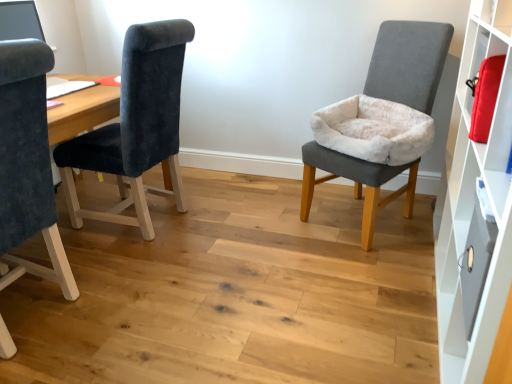
Question: Can you confirm if metallic gray drawer at right is bigger than velvet dark blue chair at left, positioned as the second chair in right-to-left order?

Choices:
 (A) no
 (B) yes

Answer: (A)

Question: From a real-world perspective, is metallic gray drawer at right on velvet dark blue chair at left, the second chair positioned from the left?

Choices:
 (A) no
 (B) yes

Answer: (A)

Question: Is the position of metallic gray drawer at right more distant than that of velvet dark blue chair at left, the second chair positioned from the left?

Choices:
 (A) yes
 (B) no

Answer: (B)

Question: Considering the relative sizes of metallic gray drawer at right and velvet dark blue chair at left, positioned as the second chair in right-to-left order, in the image provided, is metallic gray drawer at right taller than velvet dark blue chair at left, positioned as the second chair in right-to-left order,?

Choices:
 (A) no
 (B) yes

Answer: (A)

Question: Is metallic gray drawer at right positioned far away from velvet dark blue chair at left, positioned as the second chair in right-to-left order?

Choices:
 (A) yes
 (B) no

Answer: (A)

Question: From the image's perspective, is velvet dark blue chair at left, positioned as the second chair in right-to-left order, located above or below metallic gray drawer at right?

Choices:
 (A) below
 (B) above

Answer: (B)

Question: Do you think velvet dark blue chair at left, the second chair positioned from the left, is within metallic gray drawer at right, or outside of it?

Choices:
 (A) outside
 (B) inside

Answer: (A)

Question: From a real-world perspective, is velvet dark blue chair at left, the second chair positioned from the left, positioned above or below metallic gray drawer at right?

Choices:
 (A) below
 (B) above

Answer: (B)

Question: From their relative heights in the image, would you say velvet dark blue chair at left, the second chair positioned from the left, is taller or shorter than metallic gray drawer at right?

Choices:
 (A) short
 (B) tall

Answer: (B)

Question: Considering the positions of white matte cabinet at right and velvet gray chair at right, the first chair viewed from the right, in the image, is white matte cabinet at right wider or thinner than velvet gray chair at right, the first chair viewed from the right,?

Choices:
 (A) thin
 (B) wide

Answer: (A)

Question: From a real-world perspective, is white matte cabinet at right physically located above or below velvet gray chair at right, acting as the third chair starting from the left?

Choices:
 (A) below
 (B) above

Answer: (B)

Question: Is white matte cabinet at right taller or shorter than velvet gray chair at right, the first chair viewed from the right?

Choices:
 (A) short
 (B) tall

Answer: (B)

Question: Does point (457, 369) appear closer or farther from the camera than point (402, 61)?

Choices:
 (A) farther
 (B) closer

Answer: (B)

Question: Is velvet dark blue chair at left, the third chair viewed from the right, taller or shorter than velvet dark blue chair at left, the second chair positioned from the left?

Choices:
 (A) short
 (B) tall

Answer: (B)

Question: Looking at their shapes, would you say velvet dark blue chair at left, which is the 1th chair from left to right, is wider or thinner than velvet dark blue chair at left, the second chair positioned from the left?

Choices:
 (A) thin
 (B) wide

Answer: (A)